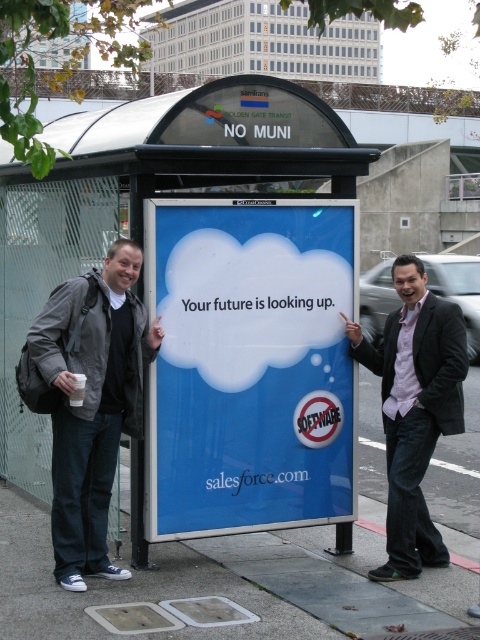
Question: Estimate the real-world distances between objects in this image. Which object is farther from the pink shirt at center?

Choices:
 (A) blue matte signboard at center
 (B) blue glossy sign at center

Answer: (B)

Question: Is the position of blue matte signboard at center less distant than that of gray fabric jacket at left?

Choices:
 (A) yes
 (B) no

Answer: (B)

Question: Can you confirm if blue glossy sign at center is thinner than gray fabric jacket at left?

Choices:
 (A) yes
 (B) no

Answer: (B)

Question: Considering the real-world distances, which object is farthest from the gray fabric jacket at left?

Choices:
 (A) blue matte signboard at center
 (B) blue glossy sign at center

Answer: (B)

Question: Among these points, which one is nearest to the camera?

Choices:
 (A) (118, 433)
 (B) (336, 294)

Answer: (A)

Question: Can you confirm if blue matte signboard at center is positioned below blue glossy sign at center?

Choices:
 (A) no
 (B) yes

Answer: (B)